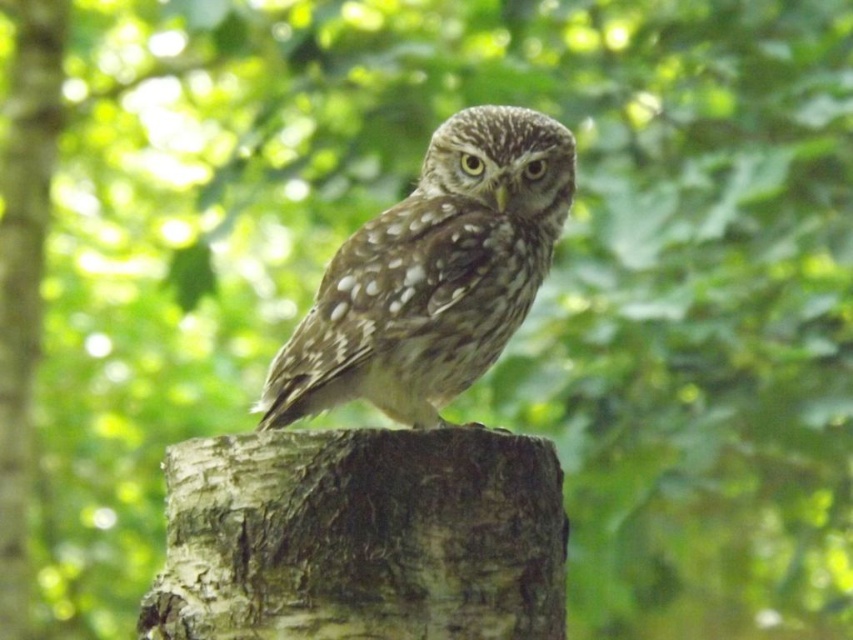
You are an ornithologist observing the speckled feathered owl at center and the smooth bark tree trunk at center. Which object is closer to you?

The speckled feathered owl at center is closer to you because it is in front of the smooth bark tree trunk at center.